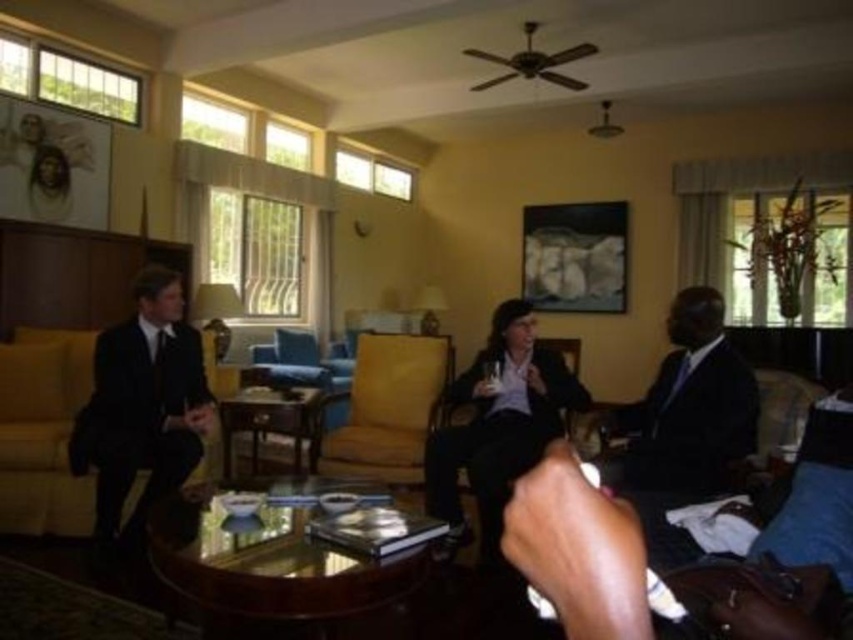
Question: Among these points, which one is nearest to the camera?

Choices:
 (A) (425, 394)
 (B) (705, 308)
 (C) (84, 385)

Answer: (B)

Question: From the image, what is the correct spatial relationship of matte black suit at right in relation to matte black armchair at center?

Choices:
 (A) above
 (B) below

Answer: (A)

Question: Does matte black suit at right appear under matte black armchair at center?

Choices:
 (A) no
 (B) yes

Answer: (A)

Question: Is matte black suit at right smaller than matte black couch at left?

Choices:
 (A) yes
 (B) no

Answer: (A)

Question: Which point is closer to the camera taking this photo?

Choices:
 (A) (486, 518)
 (B) (409, 419)
 (C) (61, 336)

Answer: (A)

Question: Considering the real-world distances, which object is farthest from the matte black armchair at center?

Choices:
 (A) matte black suit at right
 (B) matte black couch at left

Answer: (B)